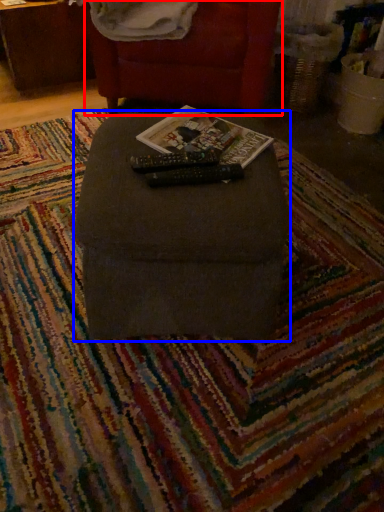
Question: Which object is further to the camera taking this photo, furniture (highlighted by a red box) or furniture (highlighted by a blue box)?

Choices:
 (A) furniture
 (B) furniture

Answer: (A)